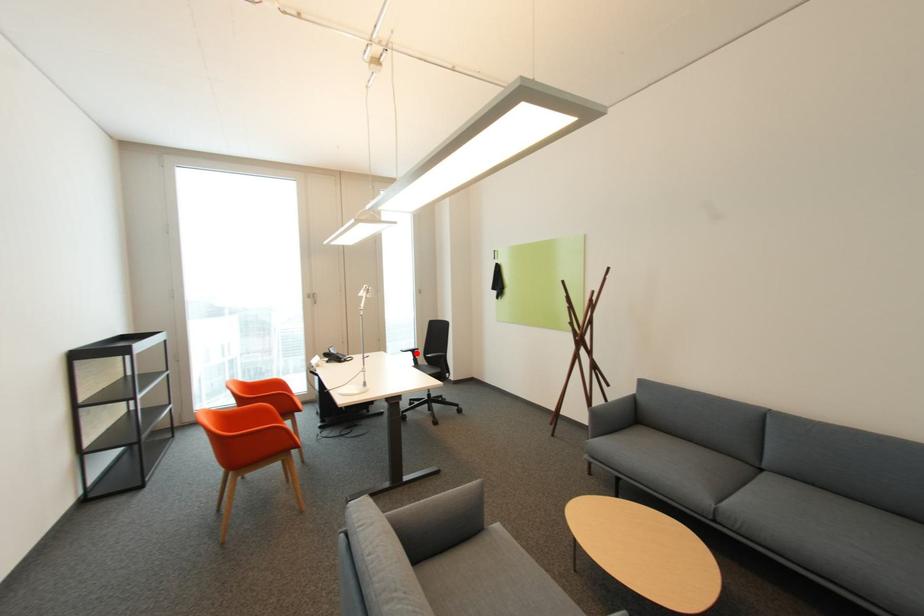
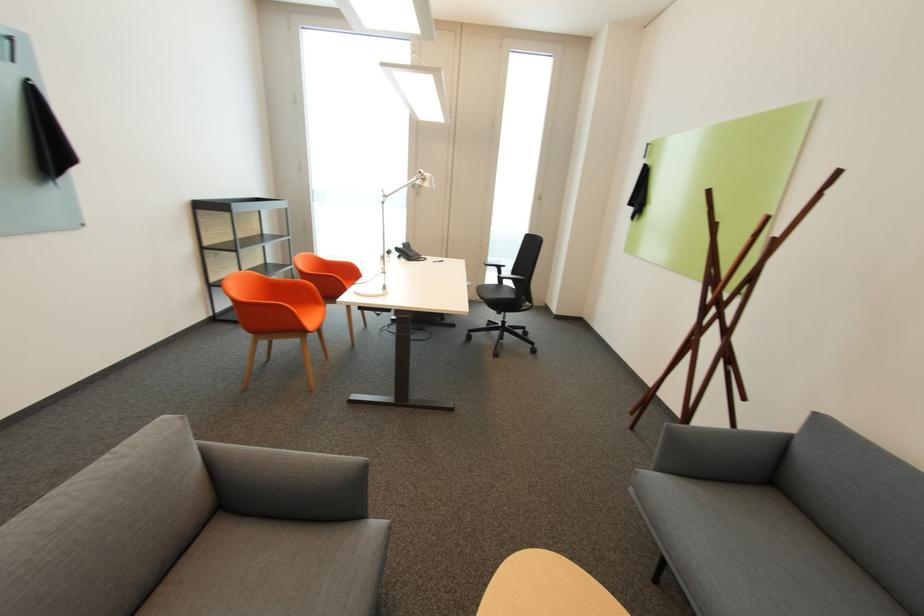
The point at the highlighted location is marked in the first image. Where is the corresponding point in the second image?

(503, 269)